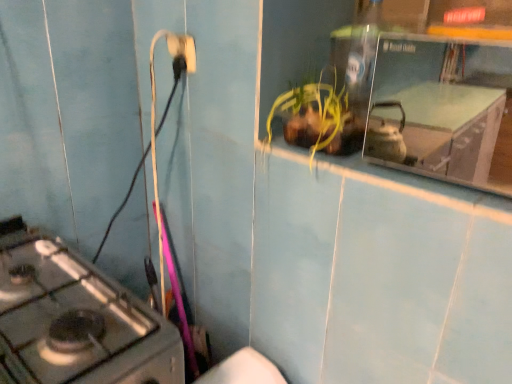
Question: In the image, is white plastic electric outlet at upper center on the left side or the right side of metallic gray gas stove at lower left?

Choices:
 (A) left
 (B) right

Answer: (B)

Question: Looking at the image, does white plastic electric outlet at upper center seem bigger or smaller compared to metallic gray gas stove at lower left?

Choices:
 (A) small
 (B) big

Answer: (A)

Question: Is white plastic electric outlet at upper center wider or thinner than metallic gray gas stove at lower left?

Choices:
 (A) thin
 (B) wide

Answer: (A)

Question: Looking at their shapes, would you say metallic gray gas stove at lower left is wider or thinner than white plastic electric outlet at upper center?

Choices:
 (A) wide
 (B) thin

Answer: (A)

Question: Do you think metallic gray gas stove at lower left is within white plastic electric outlet at upper center, or outside of it?

Choices:
 (A) inside
 (B) outside

Answer: (B)

Question: Is metallic gray gas stove at lower left to the left or to the right of white plastic electric outlet at upper center in the image?

Choices:
 (A) right
 (B) left

Answer: (B)

Question: From their relative heights in the image, would you say metallic gray gas stove at lower left is taller or shorter than white plastic electric outlet at upper center?

Choices:
 (A) short
 (B) tall

Answer: (B)